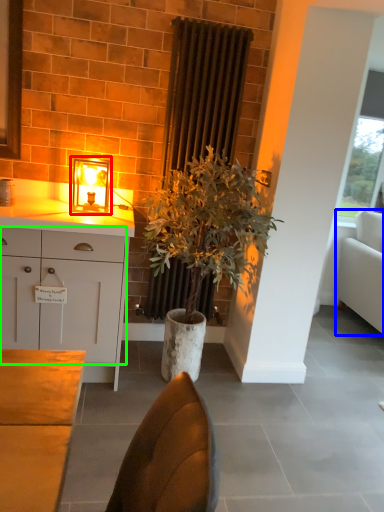
Question: Estimate the real-world distances between objects in this image. Which object is farther from table lamp (highlighted by a red box), studio couch (highlighted by a blue box) or cabinetry (highlighted by a green box)?

Choices:
 (A) studio couch
 (B) cabinetry

Answer: (A)